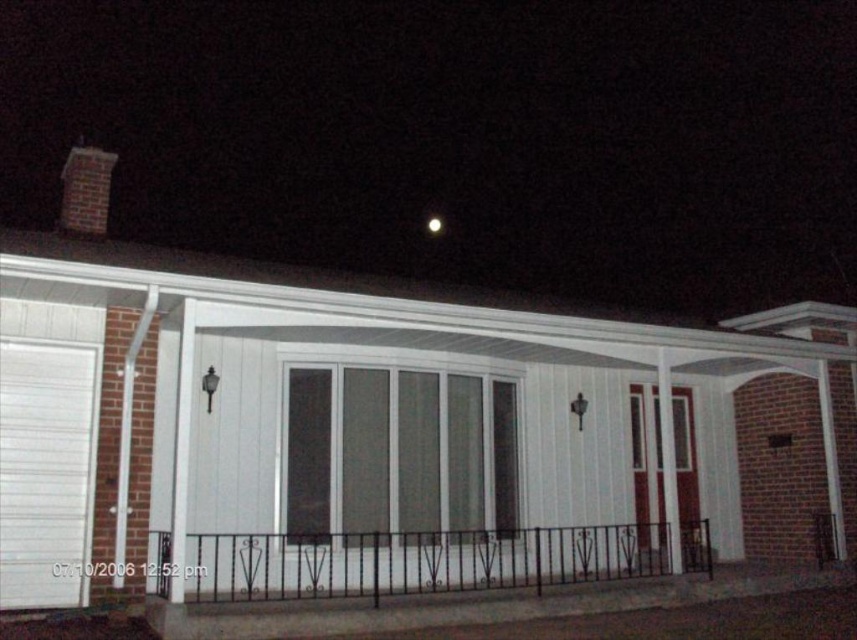
Question: Is brick chimney at upper left thinner than bright white sphere at upper center?

Choices:
 (A) yes
 (B) no

Answer: (B)

Question: Is black wrought iron railing at lower center to the left of bright white sphere at upper center from the viewer's perspective?

Choices:
 (A) no
 (B) yes

Answer: (A)

Question: Which object appears farthest from the camera in this image?

Choices:
 (A) brick chimney at upper left
 (B) black wrought iron railing at lower center
 (C) bright white sphere at upper center

Answer: (C)

Question: Which of the following is the closest to the observer?

Choices:
 (A) bright white sphere at upper center
 (B) brick chimney at upper left
 (C) black wrought iron railing at lower center

Answer: (C)

Question: From the image, what is the correct spatial relationship of brick chimney at upper left in relation to bright white sphere at upper center?

Choices:
 (A) above
 (B) below

Answer: (B)

Question: Which point appears farthest from the camera in this image?

Choices:
 (A) (434, 228)
 (B) (507, 563)
 (C) (94, 154)

Answer: (A)